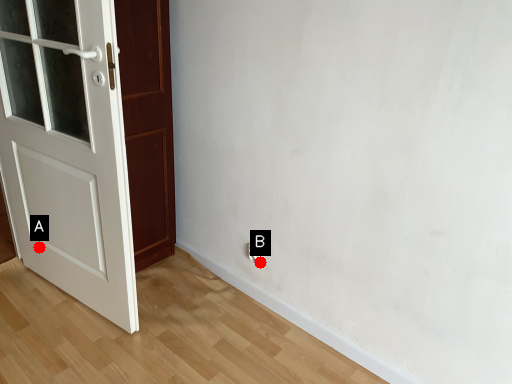
Question: Two points are circled on the image, labeled by A and B beside each circle. Which point is farther from the camera taking this photo?

Choices:
 (A) A is further
 (B) B is further

Answer: (A)